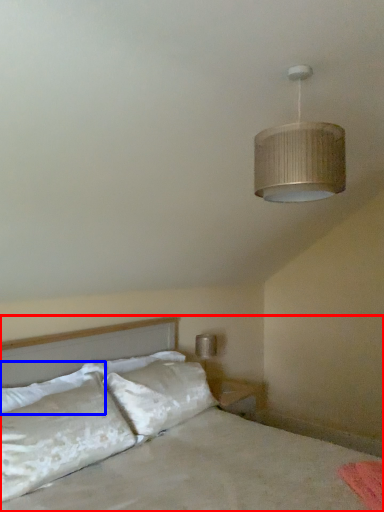
Question: Which of the following is the closest to the observer, bed (highlighted by a red box) or pillow (highlighted by a blue box)?

Choices:
 (A) bed
 (B) pillow

Answer: (A)